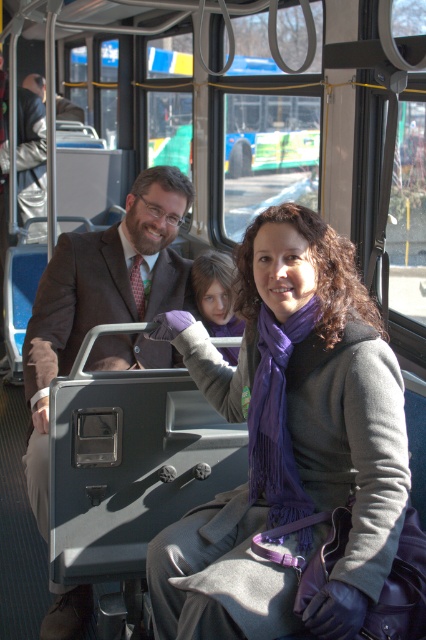
Question: Which object appears farthest from the camera in this image?

Choices:
 (A) matte brown suit at center
 (B) purple soft scarf at center

Answer: (A)

Question: Is purple soft scarf at center positioned before matte brown suit at center?

Choices:
 (A) no
 (B) yes

Answer: (B)

Question: Is purple soft scarf at center to the right of matte brown suit at center from the viewer's perspective?

Choices:
 (A) yes
 (B) no

Answer: (A)

Question: Where is purple soft scarf at center located in relation to matte brown suit at center in the image?

Choices:
 (A) above
 (B) below

Answer: (B)